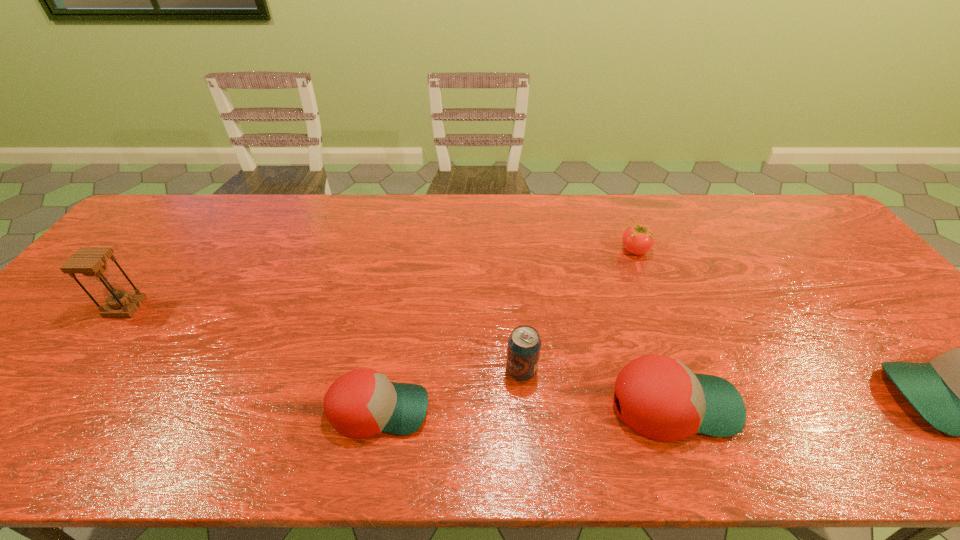
Image resolution: width=960 pixels, height=540 pixels. In order to click on free space between the fourth object from right to left and the tallest object in this screenshot , I will do `click(324, 339)`.

Locate an element on the screen. vacant point located between the third object from left to right and the tomato is located at coordinates (578, 310).

Locate an element on the screen. free spot between the shortest baseball cap and the pop soda is located at coordinates (450, 390).

You are a GUI agent. You are given a task and a screenshot of the screen. Output one action in this format:
    pyautogui.click(x=<x>, y=<y>)
    Task: Click on the free space between the second farthest object and the second object from left to right
    
    Given the screenshot: What is the action you would take?
    pyautogui.click(x=252, y=358)

Find the location of `empty space that is in between the tallest object and the second shortest baseball cap`. empty space that is in between the tallest object and the second shortest baseball cap is located at coordinates (399, 356).

Identify the location of the fourth closest object relative to the leftmost object. (637, 239).

Locate an element on the screen. the fourth closest object relative to the pop soda is located at coordinates (959, 393).

This screenshot has height=540, width=960. In order to click on baseball cap object that ranks as the second closest to the shortest baseball cap in this screenshot , I will do `click(959, 393)`.

At what (x,y) coordinates should I click in order to perform the action: click on baseball cap that can be found as the second closest to the fifth object from right to left. Please return your answer as a coordinate pair (x, y). The height and width of the screenshot is (540, 960). Looking at the image, I should click on (959, 393).